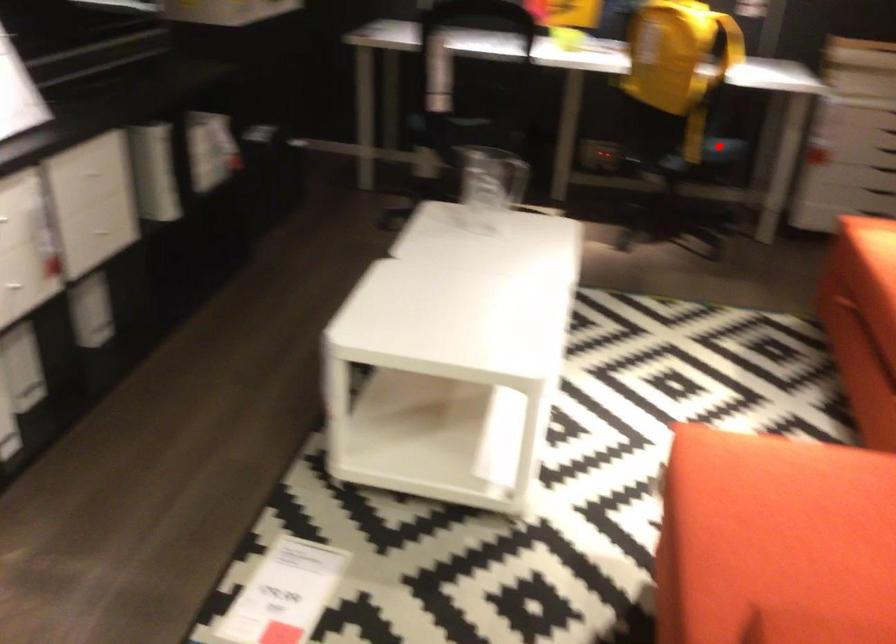
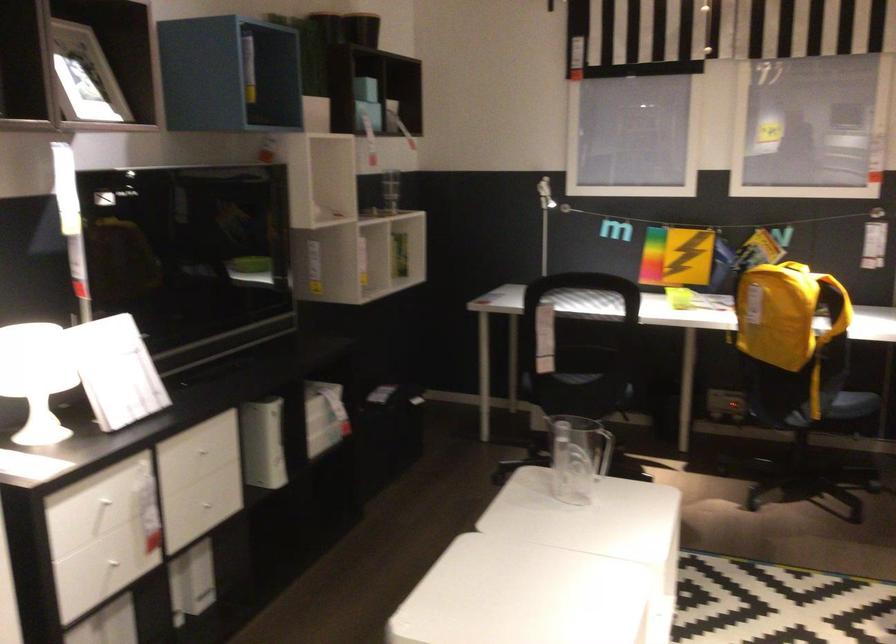
The point at the highlighted location is marked in the first image. Where is the corresponding point in the second image?

(854, 404)